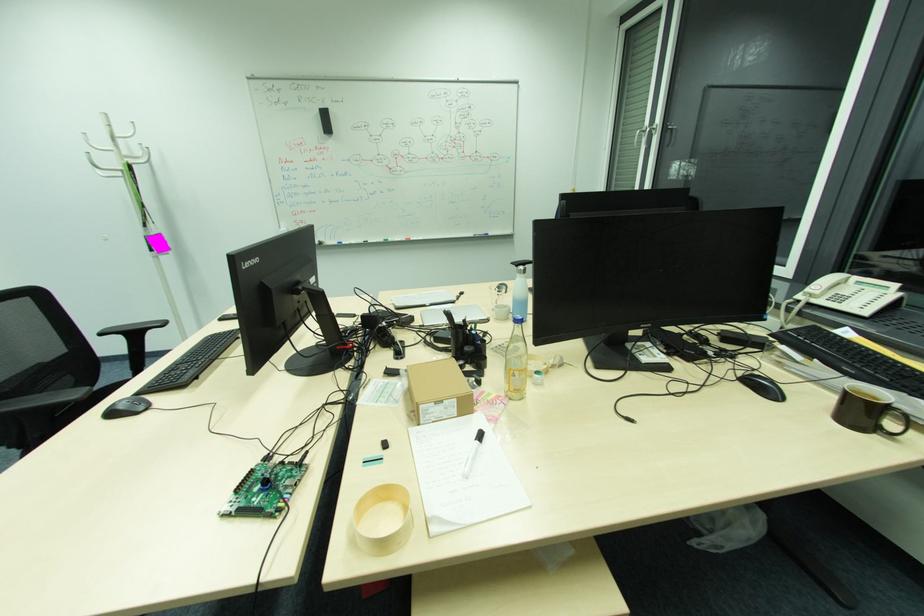
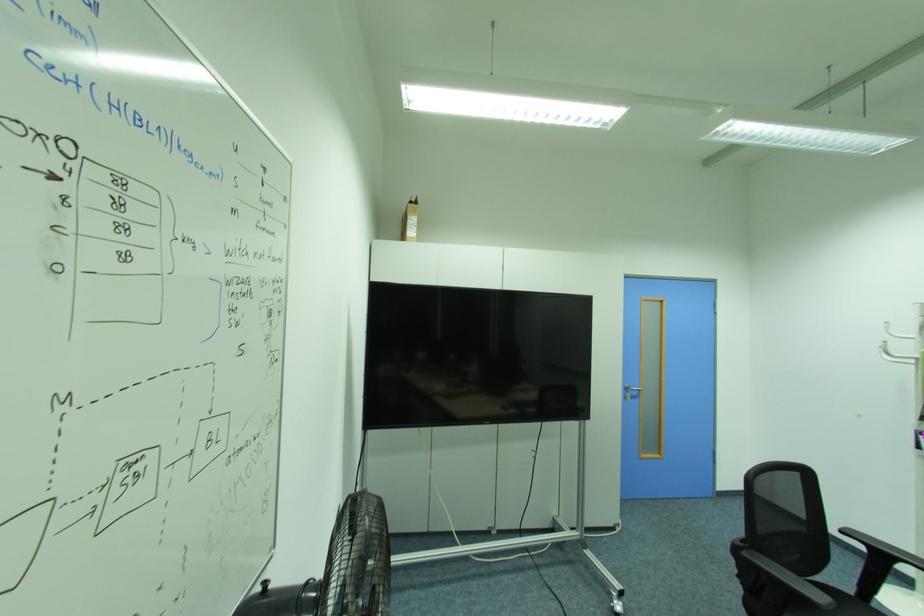
Question: How did the camera likely rotate?

Choices:
 (A) Left
 (B) Right
 (C) Up
 (D) Down

Answer: (A)